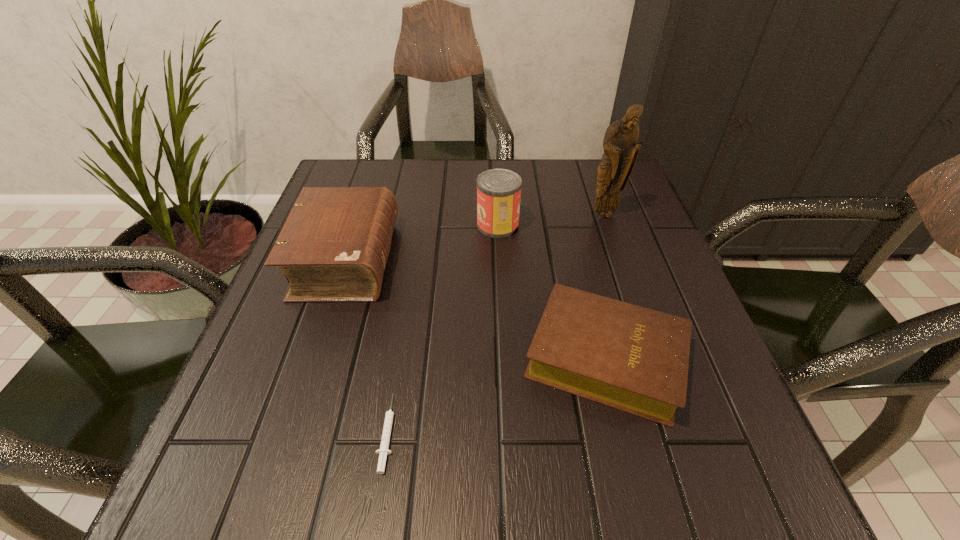
Locate an element on the screen. The image size is (960, 540). vacant space positioned on the spine side of the left Bible is located at coordinates (431, 260).

Where is `vacant space located on the back of the shorter Bible`? The width and height of the screenshot is (960, 540). vacant space located on the back of the shorter Bible is located at coordinates (577, 240).

This screenshot has height=540, width=960. I want to click on vacant point located 0.150m on the back of the fourth object from right to left, so click(405, 323).

This screenshot has width=960, height=540. Identify the location of object at the far edge. (621, 150).

Where is `object that is at the near edge`? Image resolution: width=960 pixels, height=540 pixels. object that is at the near edge is located at coordinates (384, 446).

Locate an element on the screen. This screenshot has height=540, width=960. object that is at the left edge is located at coordinates (334, 246).

Find the location of a particular element. This screenshot has width=960, height=540. figurine that is at the right edge is located at coordinates (621, 150).

You are a GUI agent. You are given a task and a screenshot of the screen. Output one action in this format:
    pyautogui.click(x=<x>, y=<y>)
    Task: Click on the Bible that is at the right edge
    The image size is (960, 540).
    Given the screenshot: What is the action you would take?
    pyautogui.click(x=631, y=358)

The image size is (960, 540). In order to click on object present at the far right corner in this screenshot , I will do `click(621, 150)`.

Image resolution: width=960 pixels, height=540 pixels. Identify the location of vacant space at the far edge of the desktop. (436, 211).